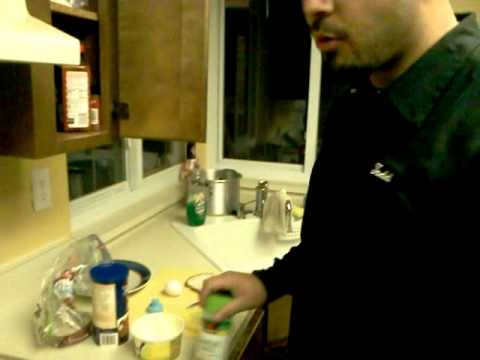
The image size is (480, 360). Identify the location of sink. (238, 242).